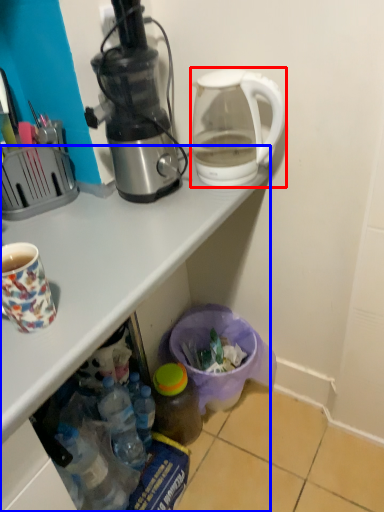
Question: Which object is further to the camera taking this photo, kettle (highlighted by a red box) or desk (highlighted by a blue box)?

Choices:
 (A) kettle
 (B) desk

Answer: (A)